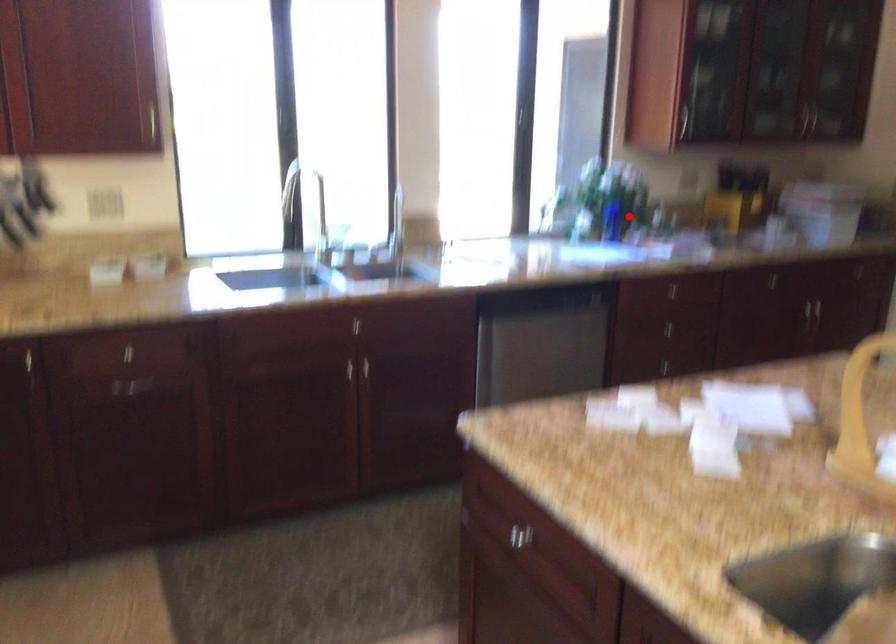
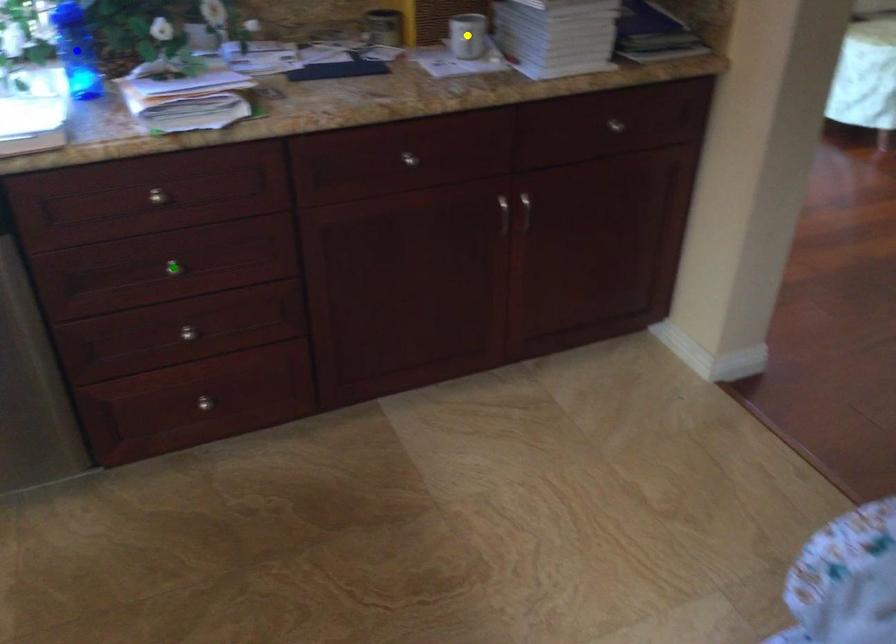
Question: I am providing you with two images of the same scene from different viewpoints. A red point is marked on the first image. You are given multiple points on the second image. Which mark in image 2 goes with the point in image 1?

Choices:
 (A) blue point
 (B) green point
 (C) yellow point

Answer: (A)